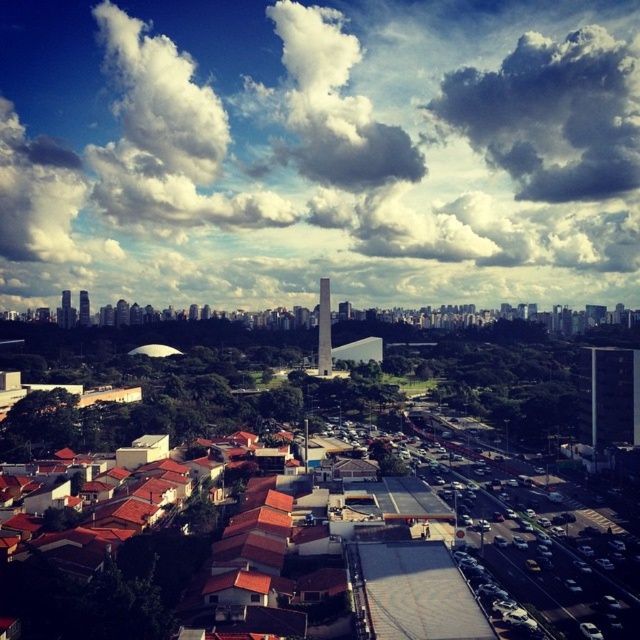
Question: Can you confirm if cloudy sky at upper center is positioned to the left of matte gray tower at left?

Choices:
 (A) yes
 (B) no

Answer: (B)

Question: Does cloudy sky at upper center have a greater width compared to matte gray tower at left?

Choices:
 (A) no
 (B) yes

Answer: (B)

Question: Is white fluffy cloud at upper center positioned at the back of matte glass skyscraper at left?

Choices:
 (A) yes
 (B) no

Answer: (A)

Question: Which of the following is the closest to the observer?

Choices:
 (A) white fluffy cloud at center
 (B) matte gray tower at left
 (C) cloudy sky at upper center
 (D) matte glass skyscraper at left

Answer: (B)

Question: Among these points, which one is nearest to the camera?

Choices:
 (A) [122, 172]
 (B) [323, 326]
 (C) [550, 132]

Answer: (B)

Question: Which point is closer to the camera?

Choices:
 (A) white fluffy cloud at center
 (B) matte glass skyscraper at left

Answer: (B)